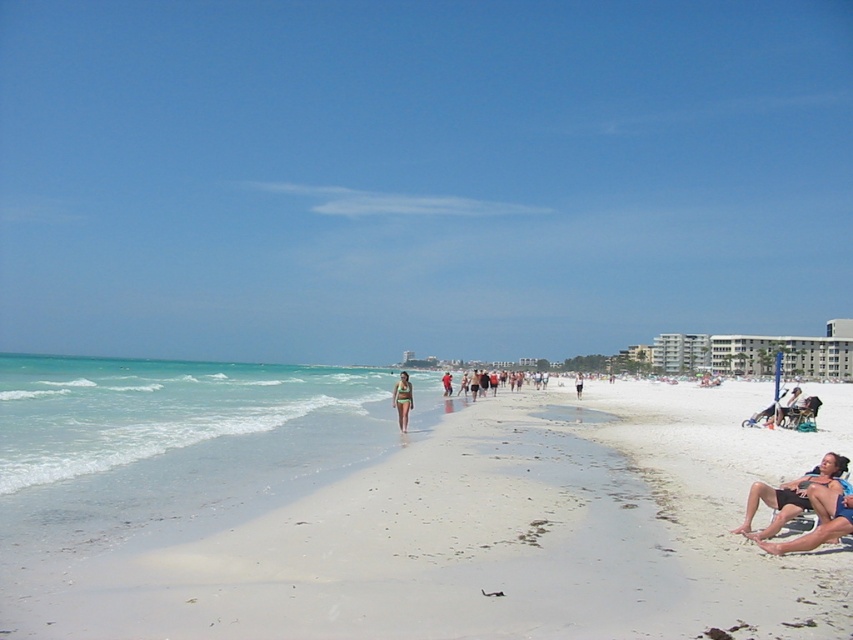
From the picture: You are standing at the edge of the beach facing the ocean. There are two points marked on the sand. One is at coordinate point (521,611) and the other at point (7,394). Which point is closer to you?

Point (521,611) is closer to the viewer than point (7,394).

You are standing at the point marked as point [398,509]. What is the name of the location you are currently standing on?

You are standing on the white sand beach at center located at point [398,509].